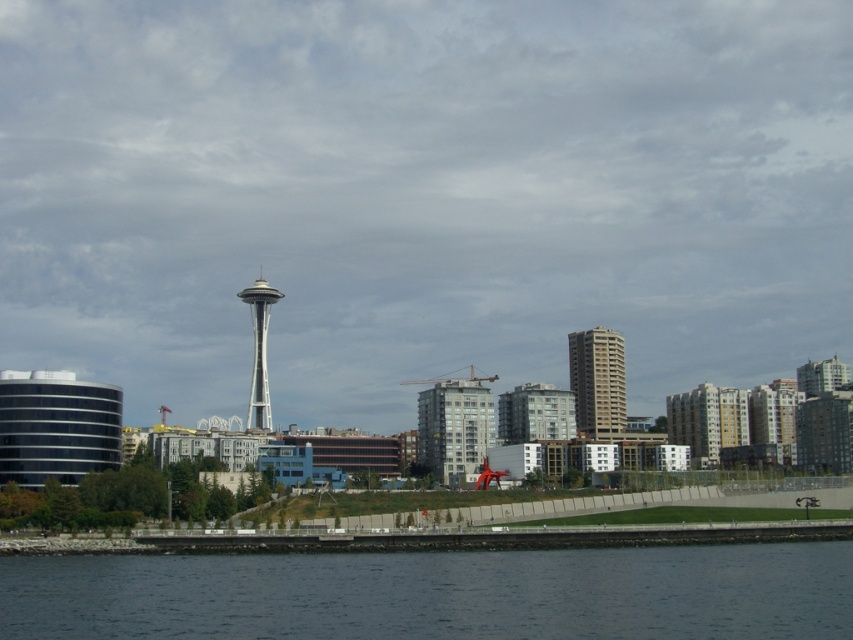
You are a drone operator planning to fly a drone from the silver metallic space needle at center to the dark blue water at lower center. The drone has a maximum flight range of 300 feet. Based on the scene, can the drone reach the water?

The distance between the silver metallic space needle at center and the dark blue water at lower center is 319.47 feet, which exceeds the drone maximum flight range of 300 feet. Therefore, the drone cannot reach the water.

You are a city planner reviewing this cityscape image. You need to determine if the beige concrete building at center can be seen from the silver metallic space needle at center. Based on their sizes, can you infer which one might block the view of the other?

The beige concrete building at center has a larger width than the silver metallic space needle at center. Since the beige concrete building at center is wider, it could potentially block the view of the silver metallic space needle at center depending on their positions, but the description does not provide information about their exact spatial arrangement beyond size.